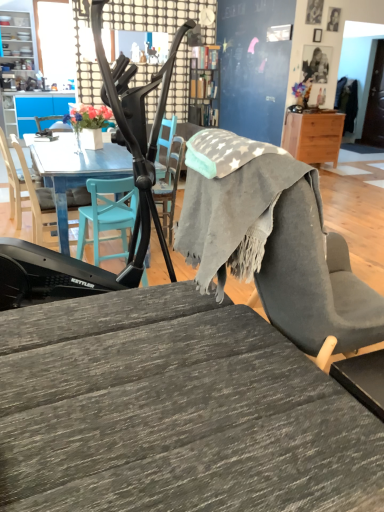
Question: From a real-world perspective, is wooden desk at right, which is counted as the second desk, starting from the left, above or below wooden desk at center, acting as the 1th desk starting from the bottom?

Choices:
 (A) above
 (B) below

Answer: (B)

Question: Considering the positions of wooden desk at right, which is counted as the second desk, starting from the front, and wooden desk at center, acting as the 1th desk starting from the bottom, in the image, is wooden desk at right, which is counted as the second desk, starting from the front, wider or thinner than wooden desk at center, acting as the 1th desk starting from the bottom,?

Choices:
 (A) thin
 (B) wide

Answer: (A)

Question: Estimate the real-world distances between objects in this image. Which object is farther from the matte black baby carriage at center?

Choices:
 (A) matte white vase at upper left
 (B) smooth black portrait at upper right, the first person positioned from the top
 (C) gray fleece blanket at center
 (D) wooden picture frame at upper right, acting as the first picture frame starting from the top
 (E) matte black chair at center, the 1th chair when ordered from right to left

Answer: (B)

Question: Which object is the farthest from the matte white shelves at upper left?

Choices:
 (A) smooth black portrait at upper right, the first person positioned from the top
 (B) wooden desk at right, which ranks as the 1th desk in right-to-left order
 (C) matte white vase at upper left
 (D) teal wood chair at left, arranged as the second chair when viewed from the left
 (E) wooden desk at center, the 1th desk positioned from the front

Answer: (E)